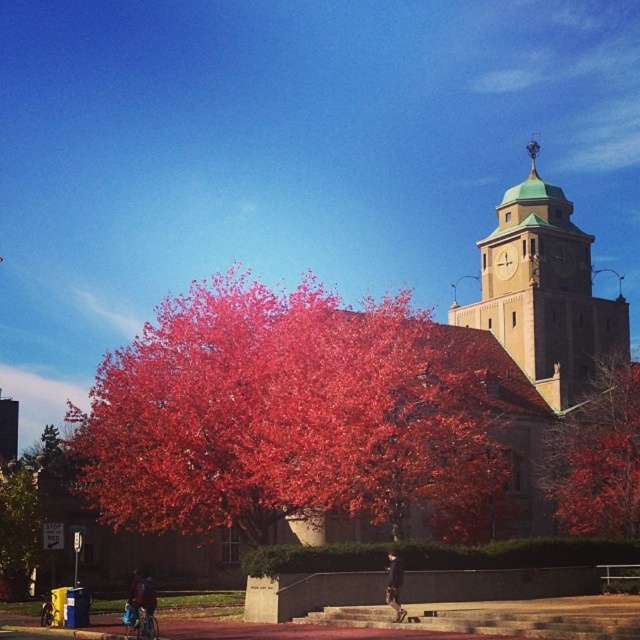
Looking at this image, you are a photographer planning to capture the smooth red tree at center and the green leafy tree at lower left in a single frame. Considering their heights, which tree will appear taller in the photo?

The smooth red tree at center appears taller in the photo because it has a greater height compared to the green leafy tree at lower left.

You are an architect assessing the proportions of the green copper clock tower at upper right and the green leafy tree at lower left in the autumn scene. Based on the image, which object appears bigger in size?

The green copper clock tower at upper right is larger in size than the green leafy tree at lower left, so it appears bigger in the image.